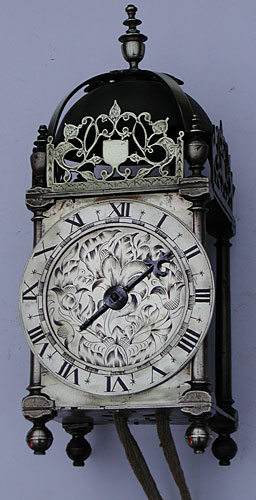
The width and height of the screenshot is (256, 500). In order to click on front body of clock in this screenshot , I will do `click(182, 205)`, `click(52, 215)`, `click(55, 394)`, `click(173, 383)`.